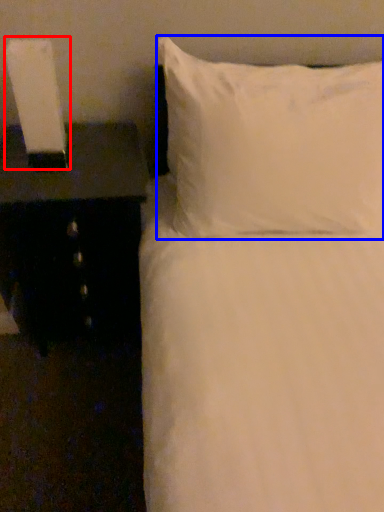
Question: Which object is closer to the camera taking this photo, bedside lamp (highlighted by a red box) or pillow (highlighted by a blue box)?

Choices:
 (A) bedside lamp
 (B) pillow

Answer: (B)